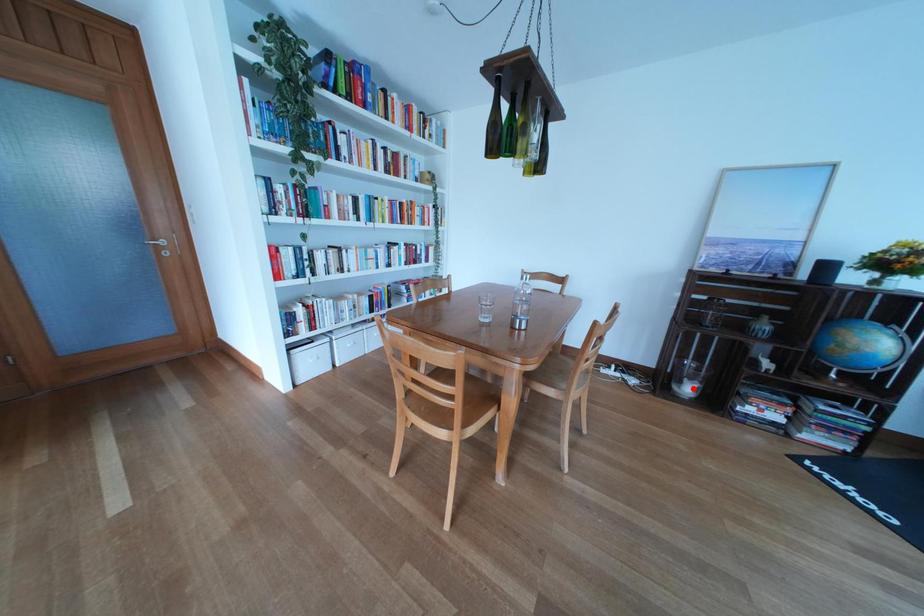
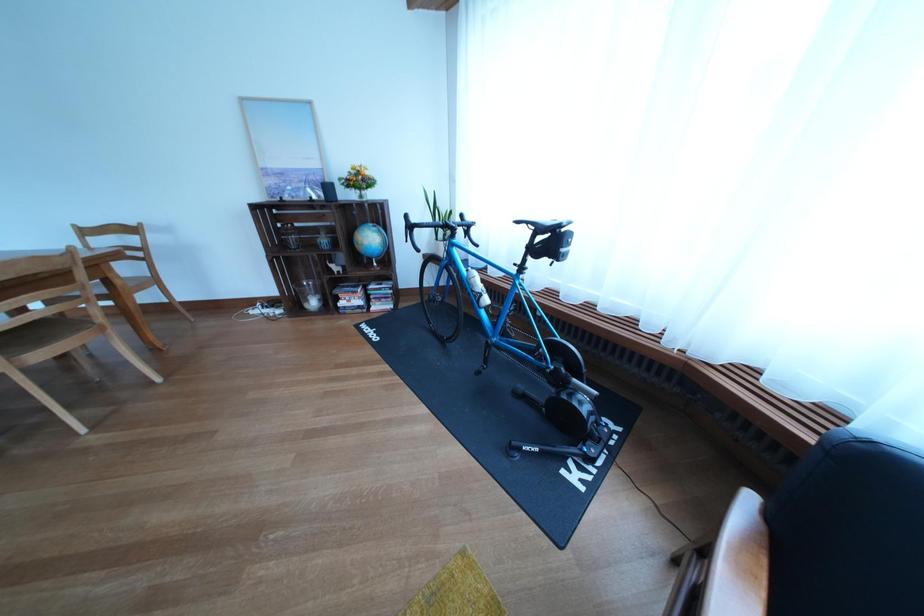
Question: I am providing you with two images of the same scene from different viewpoints. A red point is marked on the first image. Can you still see the location of the red point in image 2?

Choices:
 (A) Yes
 (B) No

Answer: (A)